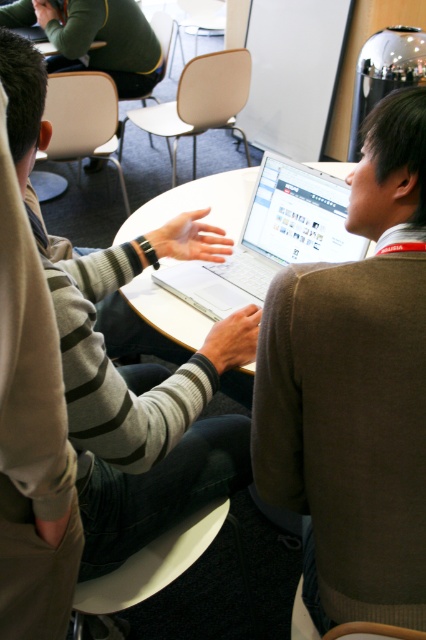
You are sitting at the white plastic chair at upper center and want to hand a document to the person wearing the brown wool sweater at upper right. Can you reach them without moving from your seat?

The brown wool sweater at upper right is in front of the white plastic chair at upper center, so you can likely reach them without moving from your seat.

You are standing at the origin of the coordinate system in the room. There are two points marked in the image, point (244, 90) and point (62, 88). If you want to move from the origin to the point that is behind the other point, which point should you go to?

Point (244, 90) is behind point (62, 88), so you should go to point (244, 90).